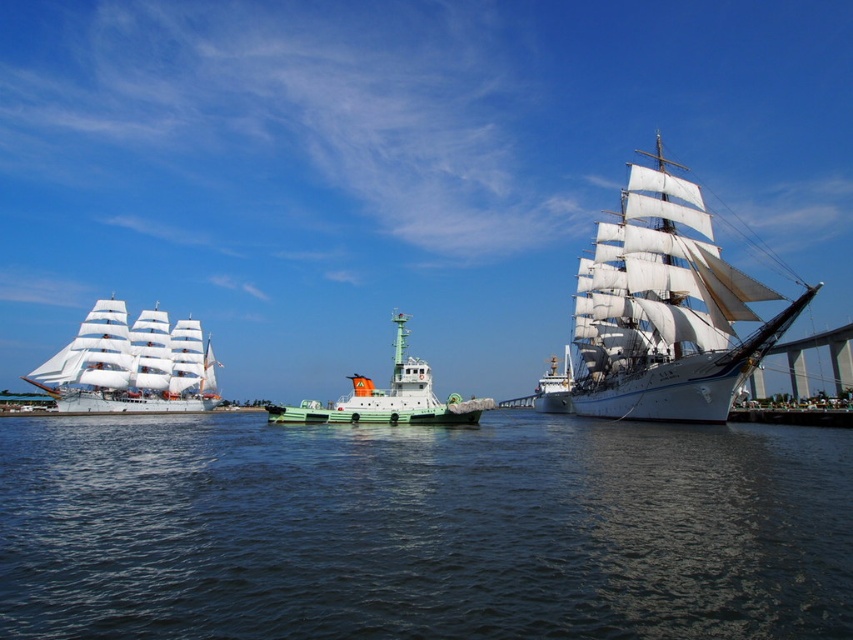
Question: Which object is closer to the camera taking this photo?

Choices:
 (A) green matte tugboat at center
 (B) dark blue water at center
 (C) white wooden sailboat at right

Answer: (B)

Question: Among these points, which one is farthest from the camera?

Choices:
 (A) (70, 540)
 (B) (697, 352)
 (C) (33, 380)
 (D) (430, 417)

Answer: (C)

Question: Does white wooden sailboat at right appear over white sailboat at left?

Choices:
 (A) yes
 (B) no

Answer: (A)

Question: Can you confirm if white wooden sailboat at right is positioned to the right of green matte tugboat at center?

Choices:
 (A) yes
 (B) no

Answer: (A)

Question: Estimate the real-world distances between objects in this image. Which object is farther from the white wooden sailboat at right?

Choices:
 (A) green matte tugboat at center
 (B) white sailboat at left

Answer: (B)

Question: Is white wooden sailboat at right wider than white sailboat at left?

Choices:
 (A) yes
 (B) no

Answer: (A)